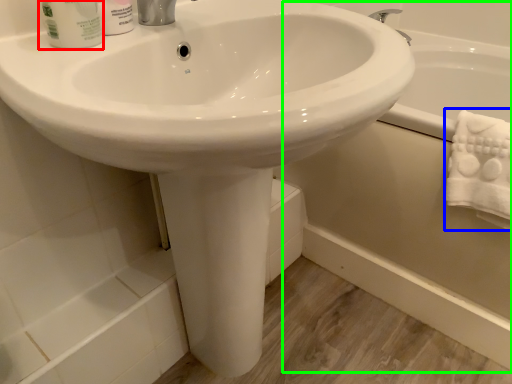
Question: Estimate the real-world distances between objects in this image. Which object is farther from mouthwash (highlighted by a red box), bath towel (highlighted by a blue box) or bath (highlighted by a green box)?

Choices:
 (A) bath towel
 (B) bath

Answer: (B)